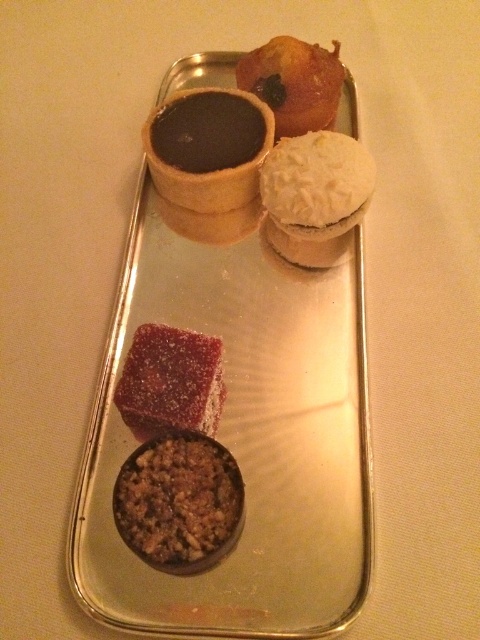
Question: Among these points, which one is farthest from the camera?

Choices:
 (A) (267, 161)
 (B) (224, 477)
 (C) (172, 403)

Answer: (A)

Question: Where is brown crumbly at lower left located in relation to shiny chocolate tartlet at upper right in the image?

Choices:
 (A) left
 (B) right

Answer: (A)

Question: Which object is positioned closest to the shiny chocolate tartlet at upper right?

Choices:
 (A) brown crumbly at lower left
 (B) shiny silver tray at center
 (C) dark chocolate muffin at upper center

Answer: (C)

Question: Is shiny silver tray at center above dark chocolate muffin at upper center?

Choices:
 (A) no
 (B) yes

Answer: (A)

Question: Which point is closer to the camera?

Choices:
 (A) dark chocolate muffin at upper center
 (B) white coconut muffin at upper right

Answer: (B)

Question: Is dark chocolate muffin at upper center to the left of shiny chocolate tartlet at upper right from the viewer's perspective?

Choices:
 (A) no
 (B) yes

Answer: (B)